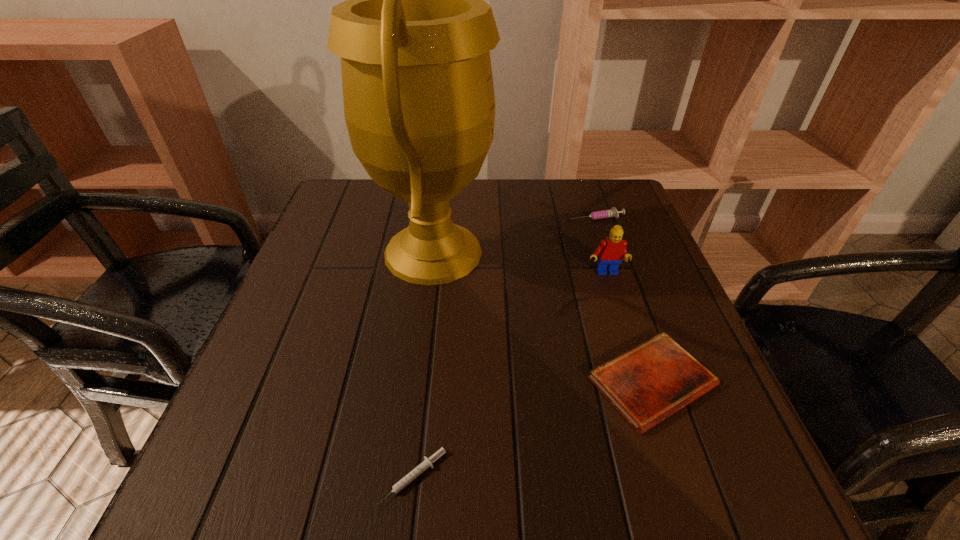
The height and width of the screenshot is (540, 960). I want to click on blank area in the image that satisfies the following two spatial constraints: 1. on the back side of the shortest object; 2. on the engravings side of the trophy, so click(438, 252).